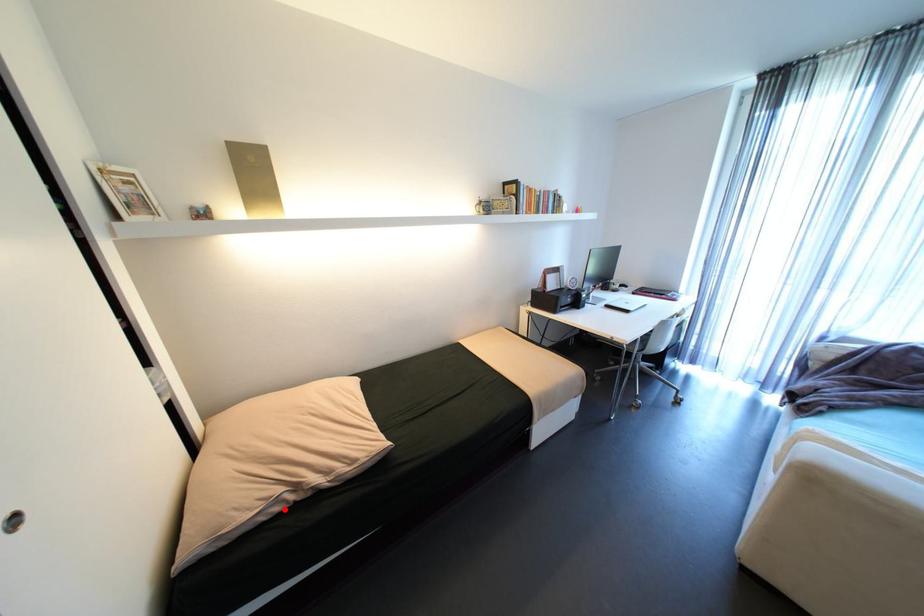
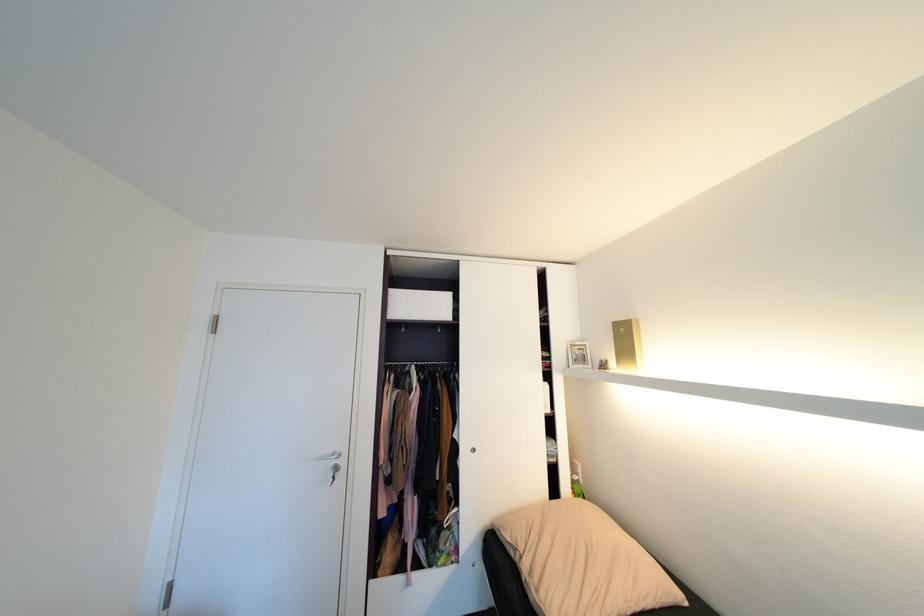
Where in the second image is the point corresponding to the highlighted location from the first image?

(518, 554)